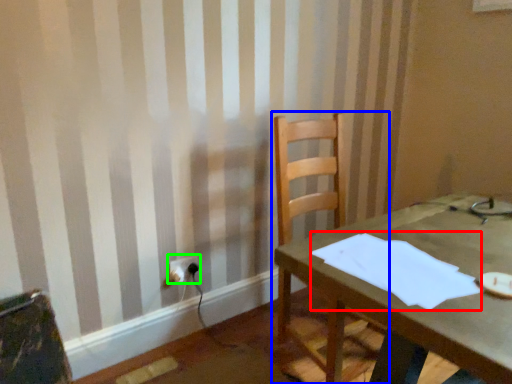
Question: Which object is the closest to the paper (highlighted by a red box)? Choose among these: chair (highlighted by a blue box) or electric outlet (highlighted by a green box).

Choices:
 (A) chair
 (B) electric outlet

Answer: (A)